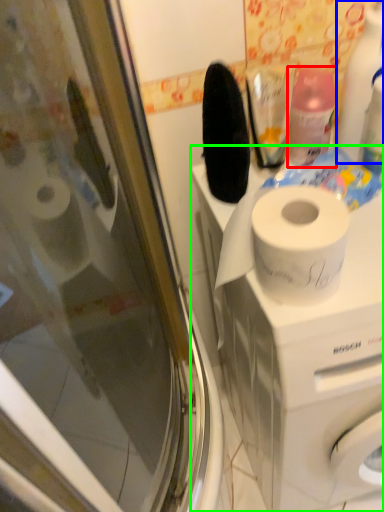
Question: Considering the real-world distances, which object is closest to cleaning product (highlighted by a red box)? cleaning product (highlighted by a blue box) or washing machine (highlighted by a green box).

Choices:
 (A) cleaning product
 (B) washing machine

Answer: (A)